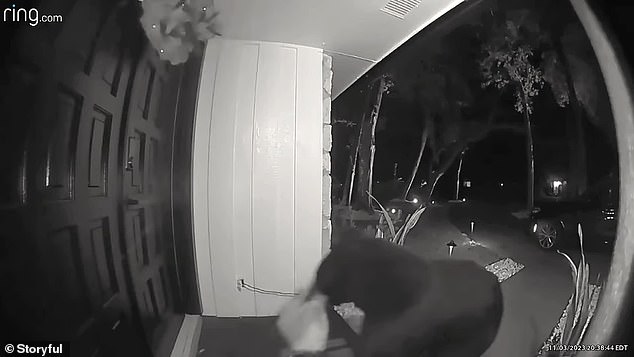
At what (x,y) coordinates should I click in order to perform the action: click on side lights to front door. Please return your answer as a coordinate pair (x, y). This screenshot has width=634, height=357. Looking at the image, I should click on (450, 246).